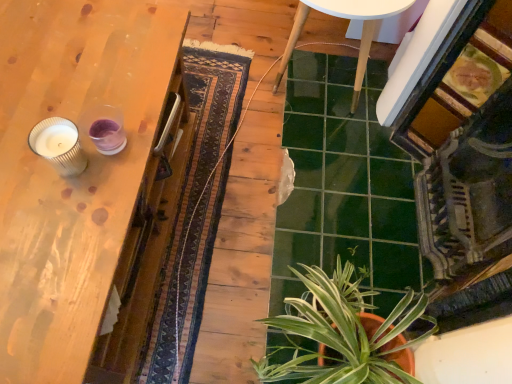
Question: Does ridged glass candle at left turn towards green glossy plant at lower right?

Choices:
 (A) yes
 (B) no

Answer: (B)

Question: From the image's perspective, is ridged glass candle at left beneath green glossy plant at lower right?

Choices:
 (A) no
 (B) yes

Answer: (A)

Question: Is ridged glass candle at left turned away from green glossy plant at lower right?

Choices:
 (A) no
 (B) yes

Answer: (A)

Question: Does ridged glass candle at left have a smaller size compared to green glossy plant at lower right?

Choices:
 (A) yes
 (B) no

Answer: (A)

Question: Can you confirm if ridged glass candle at left is bigger than green glossy plant at lower right?

Choices:
 (A) yes
 (B) no

Answer: (B)

Question: Is the surface of ridged glass candle at left in direct contact with green glossy plant at lower right?

Choices:
 (A) no
 (B) yes

Answer: (A)

Question: Is white glossy table at center at the right side of ridged glass candle at left?

Choices:
 (A) yes
 (B) no

Answer: (A)

Question: From a real-world perspective, is white glossy table at center on top of ridged glass candle at left?

Choices:
 (A) no
 (B) yes

Answer: (A)

Question: Does white glossy table at center have a larger size compared to ridged glass candle at left?

Choices:
 (A) yes
 (B) no

Answer: (A)

Question: Considering the relative sizes of white glossy table at center and ridged glass candle at left in the image provided, is white glossy table at center thinner than ridged glass candle at left?

Choices:
 (A) yes
 (B) no

Answer: (B)

Question: Is white glossy table at center turned away from ridged glass candle at left?

Choices:
 (A) yes
 (B) no

Answer: (B)

Question: Is white glossy table at center completely or partially outside of ridged glass candle at left?

Choices:
 (A) no
 (B) yes

Answer: (B)

Question: Is green glossy plant at lower right positioned with its back to wooden table at left?

Choices:
 (A) no
 (B) yes

Answer: (A)